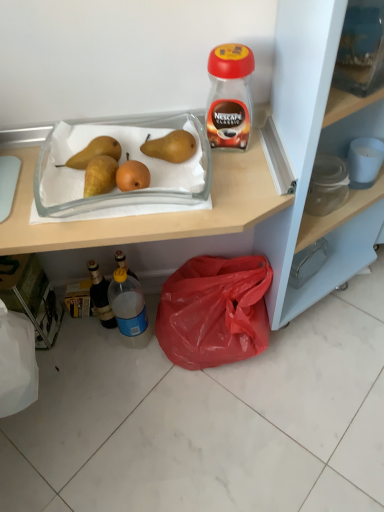
This screenshot has width=384, height=512. Identify the location of free spot in front of yellow matte pear at upper left, the first pear when ordered from left to right. (74, 202).